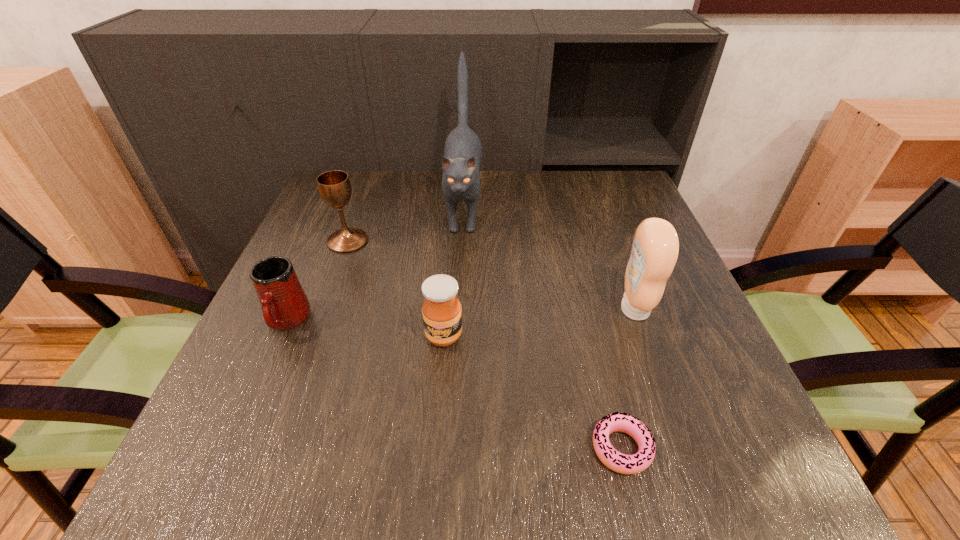
Identify the location of vacant position in the image that satisfies the following two spatial constraints: 1. on the side of the nearest object with the handle; 2. on the left side of the mug. (232, 448).

Locate an element on the screen. The image size is (960, 540). free space that satisfies the following two spatial constraints: 1. on the front-facing side of the nearest object; 2. on the right side of the honey is located at coordinates (435, 448).